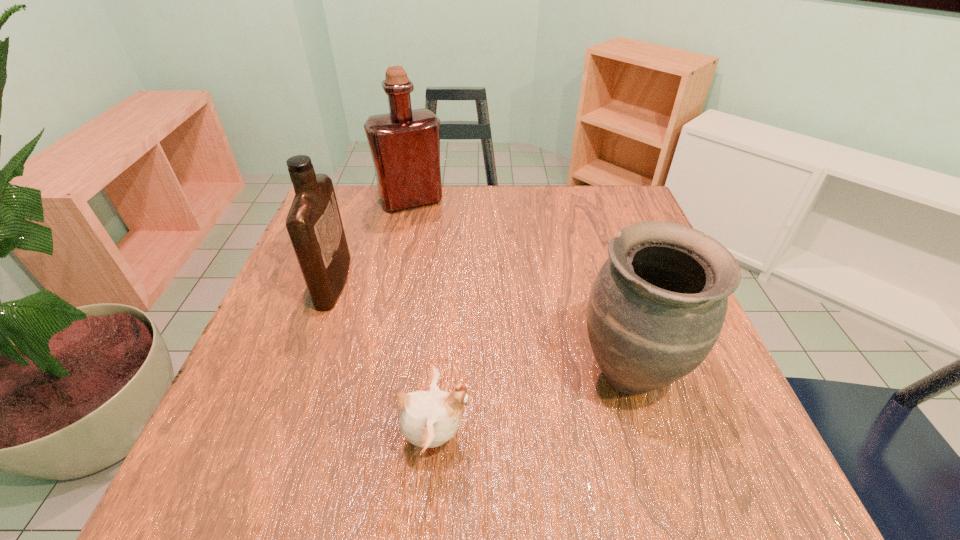
Locate an element on the screen. object located at the far edge is located at coordinates (405, 144).

Where is `object located at the near edge`? object located at the near edge is located at coordinates (428, 419).

You are a GUI agent. You are given a task and a screenshot of the screen. Output one action in this format:
    pyautogui.click(x=<x>, y=<y>)
    Task: Click on the object at the right edge
    The width and height of the screenshot is (960, 540).
    Given the screenshot: What is the action you would take?
    pyautogui.click(x=657, y=306)

You are a GUI agent. You are given a task and a screenshot of the screen. Output one action in this format:
    pyautogui.click(x=<x>, y=<y>)
    Task: Click on the object that is at the far left corner
    This screenshot has width=960, height=540.
    Given the screenshot: What is the action you would take?
    pyautogui.click(x=405, y=144)

Image resolution: width=960 pixels, height=540 pixels. Identify the location of free region at the far edge of the desktop. (448, 213).

The width and height of the screenshot is (960, 540). Find the location of `vacant region at the left edge of the desktop`. vacant region at the left edge of the desktop is located at coordinates (263, 324).

Where is `free space at the far left corner`? The image size is (960, 540). free space at the far left corner is located at coordinates 347,232.

The height and width of the screenshot is (540, 960). In order to click on free space at the far right corner of the desktop in this screenshot , I will do `click(632, 208)`.

Find the location of a particular element. This screenshot has width=960, height=540. vacant space at the near right corner of the desktop is located at coordinates 709,492.

Find the location of a particular element. The width and height of the screenshot is (960, 540). vacant point located between the right liquor and the rightmost object is located at coordinates (520, 287).